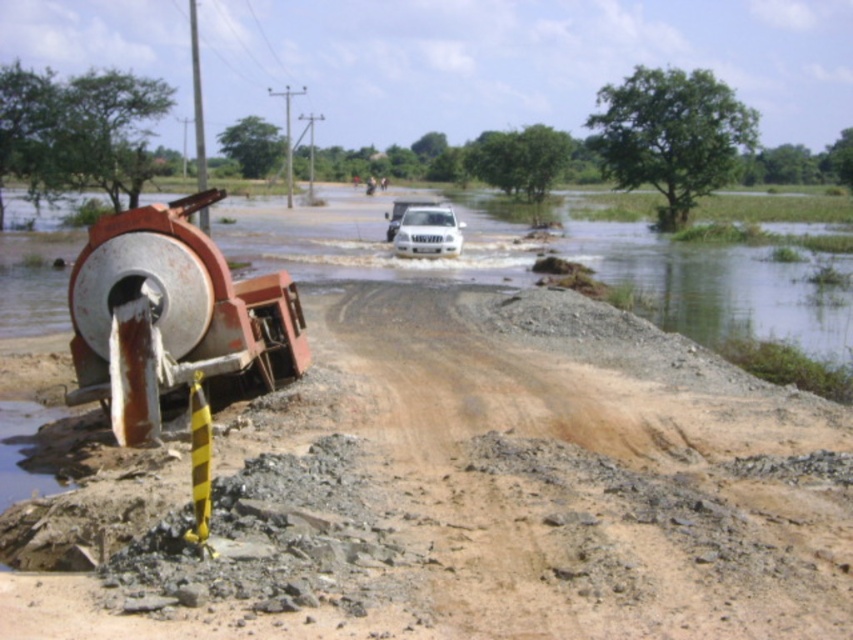
Which of these two, brown gravel dirt track at center or white matte suv at center, stands taller?

Standing taller between the two is brown gravel dirt track at center.

Between point (776, 577) and point (447, 227), which one is positioned in front?

Point (776, 577) is in front.

Locate an element on the screen. Image resolution: width=853 pixels, height=640 pixels. brown gravel dirt track at center is located at coordinates (459, 492).